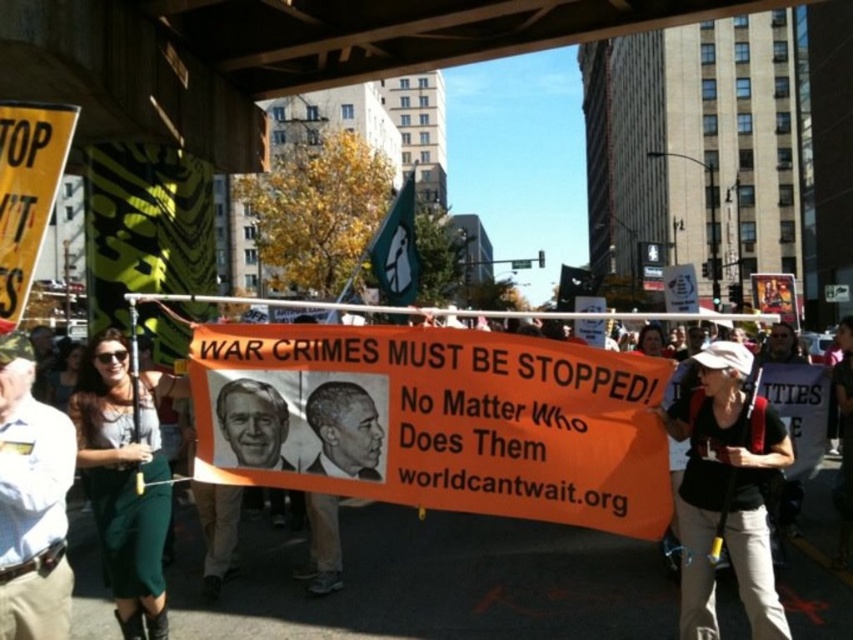
In the scene shown: You are a photographer at the protest scene. You need to capture a photo where both the green fabric dress at left and the smooth black portrait at center are visible. Which object should you frame wider in your camera to ensure it fits properly?

The green fabric dress at left should be framed wider because its width surpasses that of the smooth black portrait at center, ensuring it fits properly in the photo.

You are a photographer at the protest scene. You want to take a photo of the large orange banner held by several individuals. Where should you position yourself to ensure the green fabric dress at left is not blocking your view of the banner?

To avoid the green fabric dress at left blocking the view of the banner, position yourself to the right side of the green fabric dress at left since it is located at point (x=125, y=477), which is on the left side of the scene.